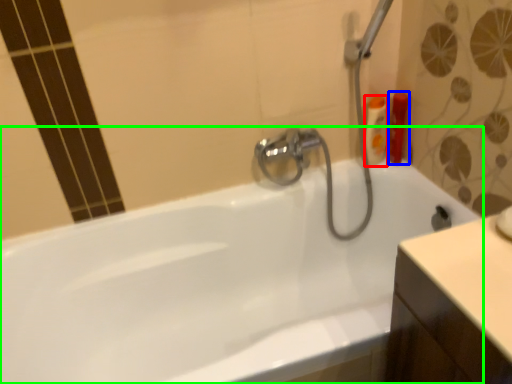
Question: Which object is the farthest from toiletry (highlighted by a red box)? Choose among these: toiletry (highlighted by a blue box) or bathtub (highlighted by a green box).

Choices:
 (A) toiletry
 (B) bathtub

Answer: (B)